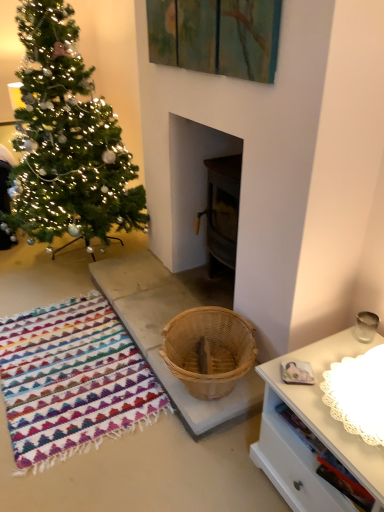
Question: In terms of width, does green matte christmas tree at left look wider or thinner when compared to multicolored woven rug at lower left?

Choices:
 (A) thin
 (B) wide

Answer: (B)

Question: Is point (14, 217) positioned closer to the camera than point (49, 462)?

Choices:
 (A) closer
 (B) farther

Answer: (B)

Question: Estimate the real-world distances between objects in this image. Which object is closer to the natural wood basket at center?

Choices:
 (A) multicolored woven rug at lower left
 (B) green matte christmas tree at left

Answer: (A)

Question: Which object is positioned farthest from the green matte christmas tree at left?

Choices:
 (A) multicolored woven rug at lower left
 (B) natural wood basket at center

Answer: (A)